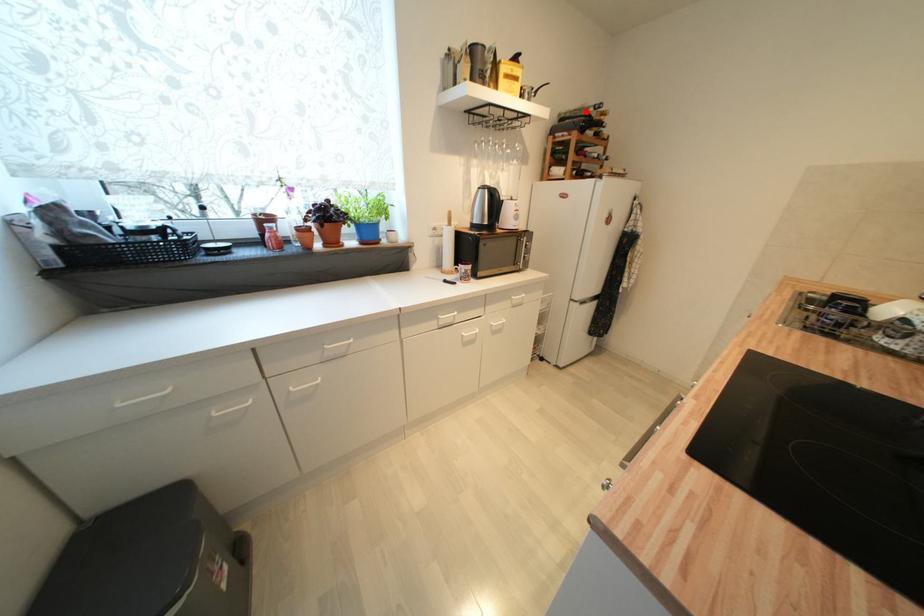
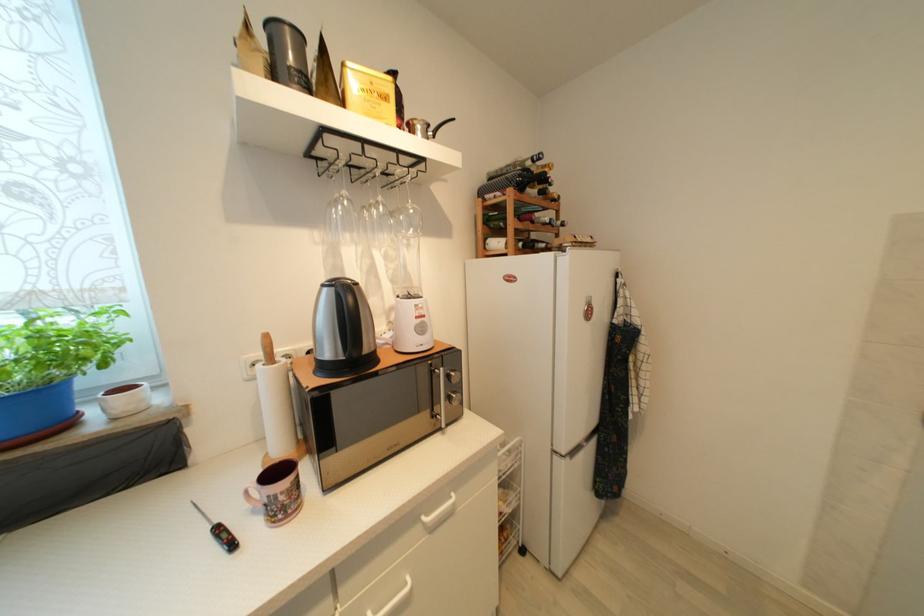
The point at the highlighted location is marked in the first image. Where is the corresponding point in the second image?

(518, 166)